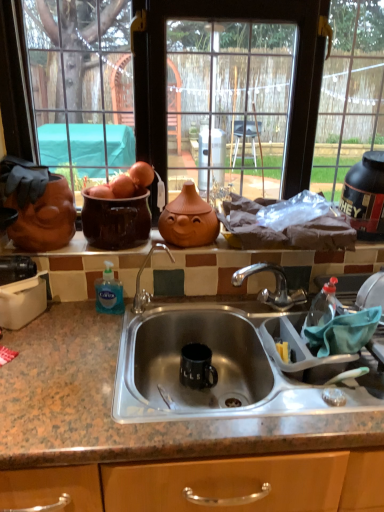
Where is `black rubber protein container at upper right`? black rubber protein container at upper right is located at coordinates (365, 196).

What do you see at coordinates (109, 292) in the screenshot? I see `blue translucent liquid soap at sink left` at bounding box center [109, 292].

What do you see at coordinates (195, 89) in the screenshot? I see `matte glass window at upper center` at bounding box center [195, 89].

I want to click on black rubber protein container at upper right, so click(x=365, y=196).

Is blue translucent liquid soap at sink left facing towards matte glass window at upper center?

No.

From the image's perspective, which one is positioned lower, blue translucent liquid soap at sink left or matte glass window at upper center?

From the image's view, blue translucent liquid soap at sink left is below.

Is blue translucent liquid soap at sink left positioned far away from matte glass window at upper center?

No.

Is black rubber protein container at upper right turned away from granite countertop at center?

No, black rubber protein container at upper right is not facing away from granite countertop at center.

Does point (378, 237) appear closer or farther from the camera than point (28, 426)?

Point (378, 237) is farther from the camera than point (28, 426).

Is black rubber protein container at upper right beside granite countertop at center?

black rubber protein container at upper right and granite countertop at center are not in contact.

Considering the relative sizes of black rubber protein container at upper right and granite countertop at center in the image provided, is black rubber protein container at upper right smaller than granite countertop at center?

Correct, black rubber protein container at upper right occupies less space than granite countertop at center.

From the image's perspective, would you say blue translucent liquid soap at sink left is shown under granite countertop at center?

No, from the image's perspective, blue translucent liquid soap at sink left is not beneath granite countertop at center.

Between blue translucent liquid soap at sink left and granite countertop at center, which one has larger width?

Wider between the two is granite countertop at center.

Is blue translucent liquid soap at sink left far away from granite countertop at center?

No, blue translucent liquid soap at sink left is not far from granite countertop at center.

In the scene shown: Who is shorter, blue translucent liquid soap at sink left or granite countertop at center?

blue translucent liquid soap at sink left is shorter.

Looking at this image, is blue translucent liquid soap at sink left next to black rubber protein container at upper right?

No, blue translucent liquid soap at sink left is not in contact with black rubber protein container at upper right.

Based on the photo, is blue translucent liquid soap at sink left facing away from black rubber protein container at upper right?

That's not correct — blue translucent liquid soap at sink left is not looking away from black rubber protein container at upper right.

What's the angular difference between blue translucent liquid soap at sink left and black rubber protein container at upper right's facing directions?

8.98 degrees.

Is blue translucent liquid soap at sink left positioned before black rubber protein container at upper right?

Yes, blue translucent liquid soap at sink left is closer to the camera.

At what (x,y) coordinates should I click in order to perform the action: click on window that is on the left side of black rubber protein container at upper right. Please return your answer as a coordinate pair (x, y). Looking at the image, I should click on (195, 89).

In the scene shown: Considering the sizes of matte glass window at upper center and black rubber protein container at upper right in the image, is matte glass window at upper center bigger or smaller than black rubber protein container at upper right?

In the image, matte glass window at upper center appears to be larger than black rubber protein container at upper right.

Does point (326, 126) come farther from viewer compared to point (342, 210)?

Yes, point (326, 126) is farther from viewer.

Which is behind, matte glass window at upper center or black rubber protein container at upper right?

Positioned behind is black rubber protein container at upper right.

Is black rubber protein container at upper right positioned with its back to blue translucent liquid soap at sink left?

No, black rubber protein container at upper right is not facing the opposite direction of blue translucent liquid soap at sink left.

The height and width of the screenshot is (512, 384). I want to click on appliance above the blue translucent liquid soap at sink left (from the image's perspective), so click(x=365, y=196).

Considering the sizes of black rubber protein container at upper right and blue translucent liquid soap at sink left in the image, is black rubber protein container at upper right wider or thinner than blue translucent liquid soap at sink left?

black rubber protein container at upper right is wider than blue translucent liquid soap at sink left.

Relative to blue translucent liquid soap at sink left, is black rubber protein container at upper right in front or behind?

black rubber protein container at upper right is positioned farther from the viewer than blue translucent liquid soap at sink left.

Considering the sizes of granite countertop at center and matte glass window at upper center in the image, is granite countertop at center bigger or smaller than matte glass window at upper center?

Clearly, granite countertop at center is smaller in size than matte glass window at upper center.

How far apart are granite countertop at center and matte glass window at upper center?

A distance of 28.48 inches exists between granite countertop at center and matte glass window at upper center.

What are the coordinates of `window behind the granite countertop at center` in the screenshot? It's located at (195, 89).

Is granite countertop at center facing away from matte glass window at upper center?

No, granite countertop at center is not facing away from matte glass window at upper center.

Find the location of `window on the right of blue translucent liquid soap at sink left`. window on the right of blue translucent liquid soap at sink left is located at coordinates (195, 89).

Find the location of `countertop located on the left of black rubber protein container at upper right`. countertop located on the left of black rubber protein container at upper right is located at coordinates (113, 405).

Estimate the real-world distances between objects in this image. Which object is closer to black rubber protein container at upper right, granite countertop at center or matte glass window at upper center?

Based on the image, matte glass window at upper center appears to be nearer to black rubber protein container at upper right.

In the scene shown: Considering their positions, is matte glass window at upper center positioned closer to black rubber protein container at upper right than blue translucent liquid soap at sink left?

matte glass window at upper center is closer to black rubber protein container at upper right.

Looking at the image, which one is located further to black rubber protein container at upper right, blue translucent liquid soap at sink left or matte glass window at upper center?

blue translucent liquid soap at sink left is positioned further to the anchor black rubber protein container at upper right.

Based on their spatial positions, is black rubber protein container at upper right or granite countertop at center closer to blue translucent liquid soap at sink left?

The object closer to blue translucent liquid soap at sink left is granite countertop at center.

Based on their spatial positions, is black rubber protein container at upper right or matte glass window at upper center further from blue translucent liquid soap at sink left?

Based on the image, black rubber protein container at upper right appears to be further to blue translucent liquid soap at sink left.

Based on their spatial positions, is matte glass window at upper center or blue translucent liquid soap at sink left closer to granite countertop at center?

blue translucent liquid soap at sink left lies closer to granite countertop at center than the other object.

Based on their spatial positions, is black rubber protein container at upper right or blue translucent liquid soap at sink left closer to granite countertop at center?

Among the two, blue translucent liquid soap at sink left is located nearer to granite countertop at center.

Which object lies nearer to the anchor point matte glass window at upper center, blue translucent liquid soap at sink left or granite countertop at center?

Based on the image, blue translucent liquid soap at sink left appears to be nearer to matte glass window at upper center.

The image size is (384, 512). I want to click on bottle between matte glass window at upper center and granite countertop at center vertically, so click(x=109, y=292).

This screenshot has height=512, width=384. I want to click on window situated between blue translucent liquid soap at sink left and black rubber protein container at upper right from left to right, so click(195, 89).

In order to click on appliance between matte glass window at upper center and granite countertop at center from top to bottom in this screenshot , I will do `click(365, 196)`.

Identify the location of countertop between blue translucent liquid soap at sink left and black rubber protein container at upper right. The image size is (384, 512). (113, 405).